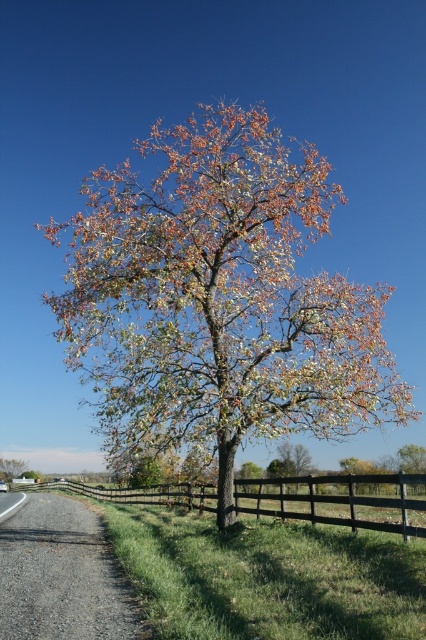
Question: Among these objects, which one is nearest to the camera?

Choices:
 (A) green leafy tree at center
 (B) gravel road at lower left
 (C) brown wooden fence at center

Answer: (B)

Question: Is autumn leaves wood at center in front of green leafy tree at center?

Choices:
 (A) yes
 (B) no

Answer: (A)

Question: Among these objects, which one is farthest from the camera?

Choices:
 (A) brown wooden fence at center
 (B) green leafy tree at center

Answer: (B)

Question: Among these objects, which one is farthest from the camera?

Choices:
 (A) autumn leaves wood at center
 (B) brown wooden fence at center
 (C) green leafy tree at center
 (D) gravel road at lower left

Answer: (C)

Question: Can you confirm if autumn leaves wood at center is smaller than green leafy tree at center?

Choices:
 (A) no
 (B) yes

Answer: (A)

Question: Is autumn leaves wood at center above gravel road at lower left?

Choices:
 (A) yes
 (B) no

Answer: (A)